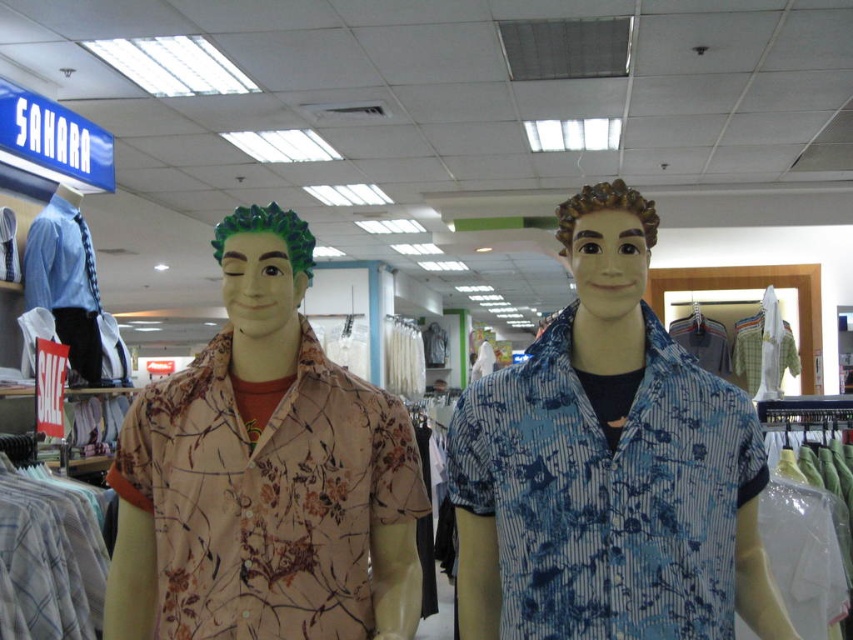
Is point (584, 552) positioned behind point (173, 508)?

No, (584, 552) is closer to viewer.

Between point (665, 531) and point (194, 536), which one is positioned behind?

The point (194, 536) is behind.

Find the location of a particular element. The image size is (853, 640). blue striped shirt at center is located at coordinates (608, 467).